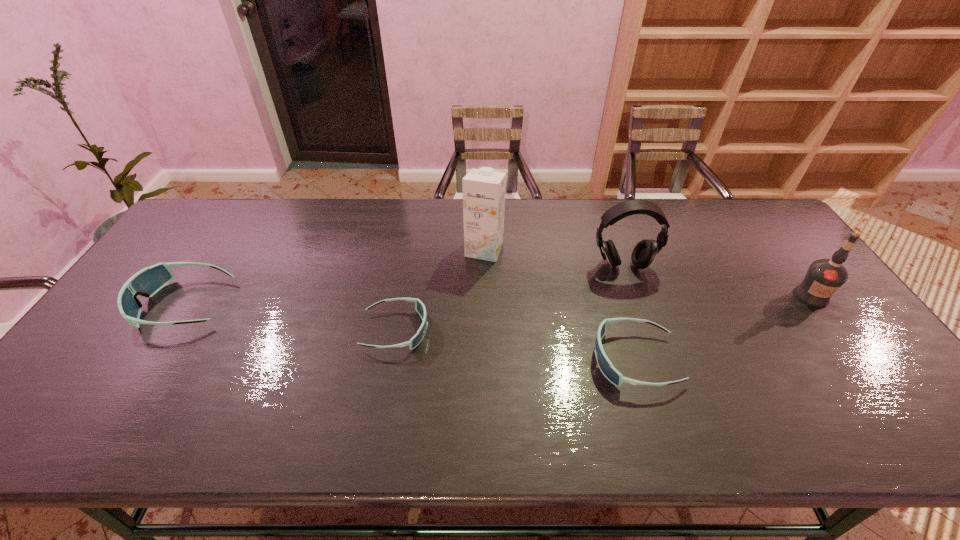
Locate an element on the screen. empty space that is in between the leftmost object and the fourth object from right to left is located at coordinates (334, 276).

Where is `blank region between the rightmost goggles and the vodka`? This screenshot has height=540, width=960. blank region between the rightmost goggles and the vodka is located at coordinates (723, 328).

Identify the location of vacant space that's between the fifth tallest object and the rightmost object. (723, 328).

Locate an element on the screen. The width and height of the screenshot is (960, 540). vacant space in between the rightmost goggles and the earphone is located at coordinates (629, 313).

Locate an element on the screen. free spot between the earphone and the shortest goggles is located at coordinates (509, 298).

I want to click on the third closest object to the shortest goggles, so click(609, 371).

The width and height of the screenshot is (960, 540). Identify the location of object that stands as the second closest to the earphone. (484, 189).

This screenshot has height=540, width=960. In order to click on goggles that can be found as the closest to the leftmost object in this screenshot , I will do `click(419, 306)`.

Identify which goggles is the third nearest to the fourth object from right to left. Please provide its 2D coordinates. Your answer should be formatted as a tuple, i.e. [(x, y)], where the tuple contains the x and y coordinates of a point satisfying the conditions above.

[(147, 282)]

This screenshot has width=960, height=540. In order to click on vacant area in the image that satisfies the following two spatial constraints: 1. on the front label of the vodka; 2. on the front-facing side of the leftmost object in this screenshot , I will do `click(817, 304)`.